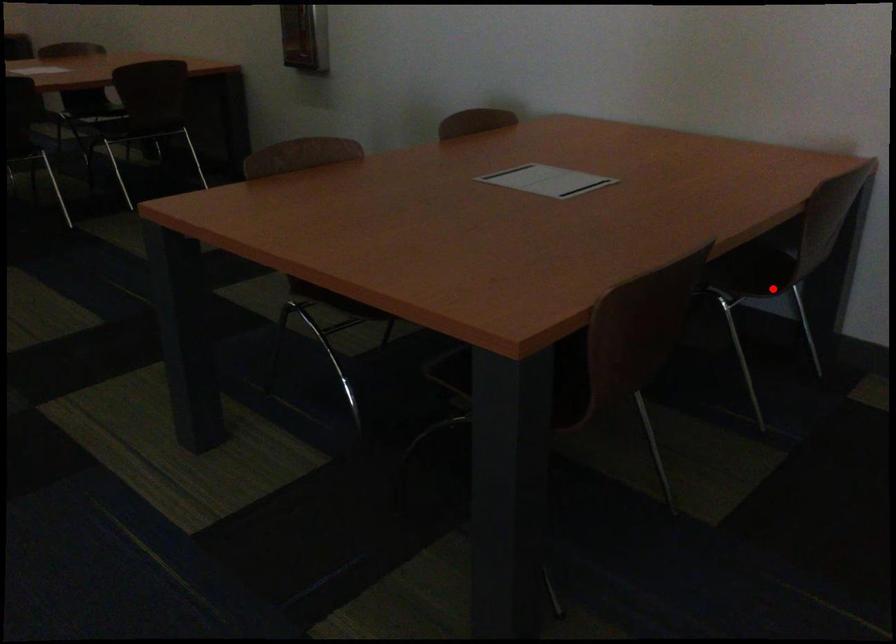
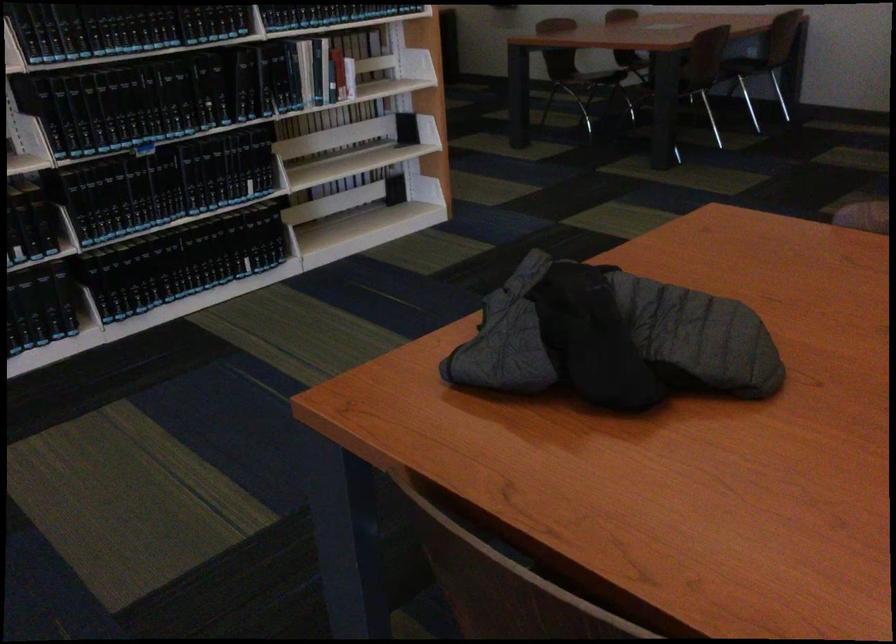
Where in the second image is the point corresponding to the highlighted location from the first image?

(743, 58)